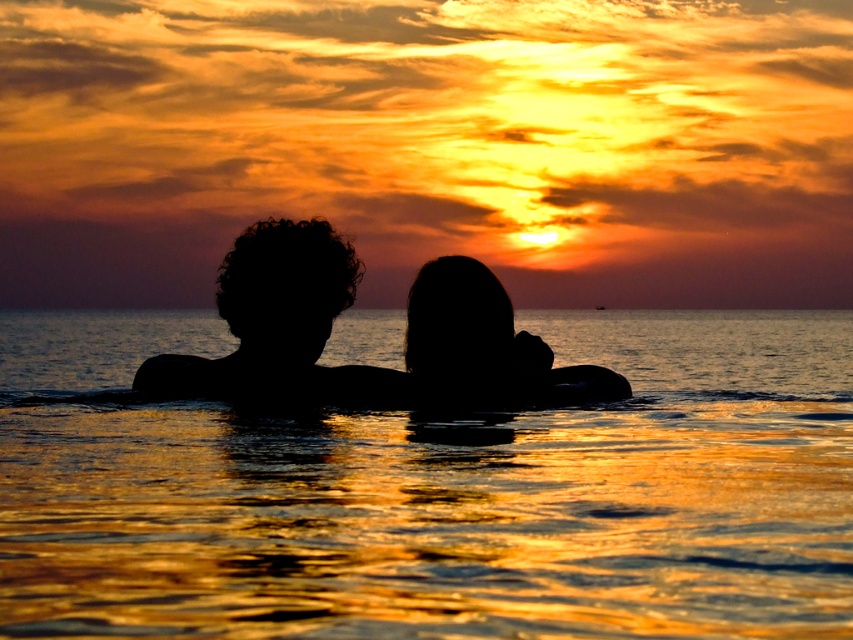
Is point (518, 566) positioned after point (496, 296)?

No, (518, 566) is in front of (496, 296).

Is point (47, 321) farther from camera compared to point (430, 355)?

Yes, point (47, 321) is farther from viewer.

Where is `golden reflective water at center`? The image size is (853, 640). golden reflective water at center is located at coordinates (433, 490).

Which of these two, golden reflective water at center or black matte hair at center, stands shorter?

black matte hair at center

This screenshot has height=640, width=853. What do you see at coordinates (433, 490) in the screenshot?
I see `golden reflective water at center` at bounding box center [433, 490].

Find the location of a particular element. The image size is (853, 640). golden reflective water at center is located at coordinates (433, 490).

From the picture: Who is taller, black matte hair at center or silhouette hair at center?

black matte hair at center is taller.

Can you confirm if black matte hair at center is positioned to the left of silhouette hair at center?

Indeed, black matte hair at center is positioned on the left side of silhouette hair at center.

Does point (287, 237) lie in front of point (433, 320)?

Yes, it is in front of point (433, 320).

In order to click on black matte hair at center in this screenshot , I will do `click(279, 324)`.